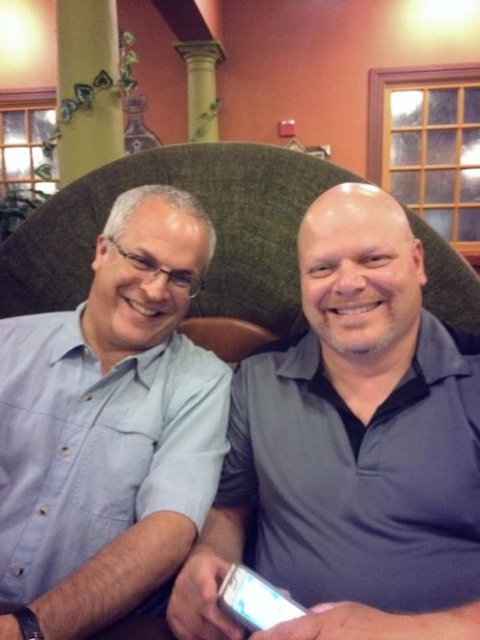
Does light blue shirt at center have a lesser width compared to gray matte shirt at center?

Yes.

How much distance is there between light blue shirt at center and gray matte shirt at center?

The distance of light blue shirt at center from gray matte shirt at center is 8.10 inches.

Find the location of a particular element. The image size is (480, 640). light blue shirt at center is located at coordinates (109, 426).